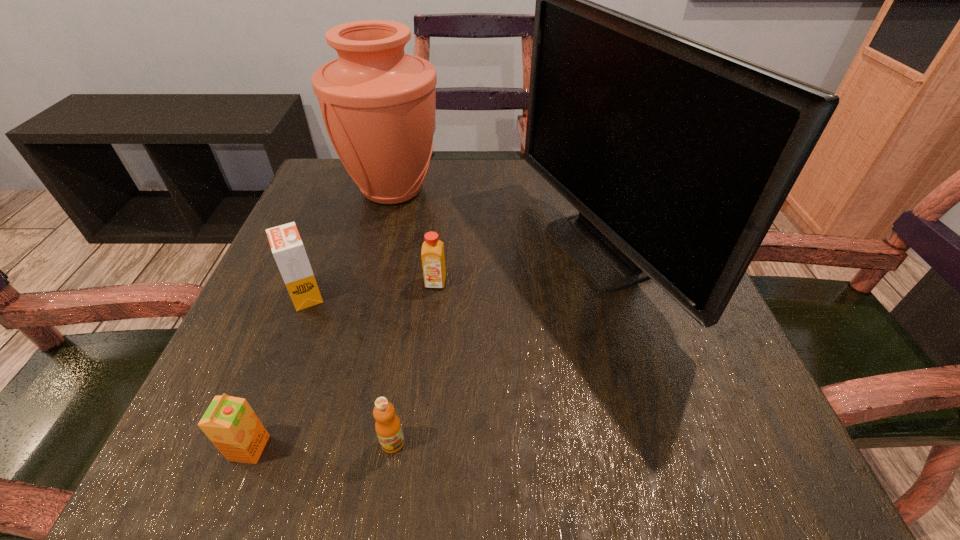
Find the location of a particular element. the tallest object is located at coordinates (678, 156).

Find the location of a particular element. Image resolution: width=960 pixels, height=540 pixels. computer monitor is located at coordinates (678, 156).

I want to click on the second tallest object, so click(x=378, y=103).

I want to click on the third tallest object, so click(x=287, y=247).

This screenshot has height=540, width=960. Find the location of `the rightmost orange juice`. the rightmost orange juice is located at coordinates (433, 261).

What are the coordinates of `the third orange juice from left to right` in the screenshot? It's located at (388, 427).

At what (x,y) coordinates should I click in order to perform the action: click on vacant space located on the front-facing side of the computer monitor. Please return your answer as a coordinate pair (x, y). Looking at the image, I should click on (328, 251).

Image resolution: width=960 pixels, height=540 pixels. In order to click on vacant space situated on the front-facing side of the computer monitor in this screenshot , I will do pos(354,251).

Find the location of `free space located on the front-facing side of the computer monitor`. free space located on the front-facing side of the computer monitor is located at coordinates (369, 251).

This screenshot has height=540, width=960. I want to click on free space located 0.250m on the right of the second tallest object, so click(550, 190).